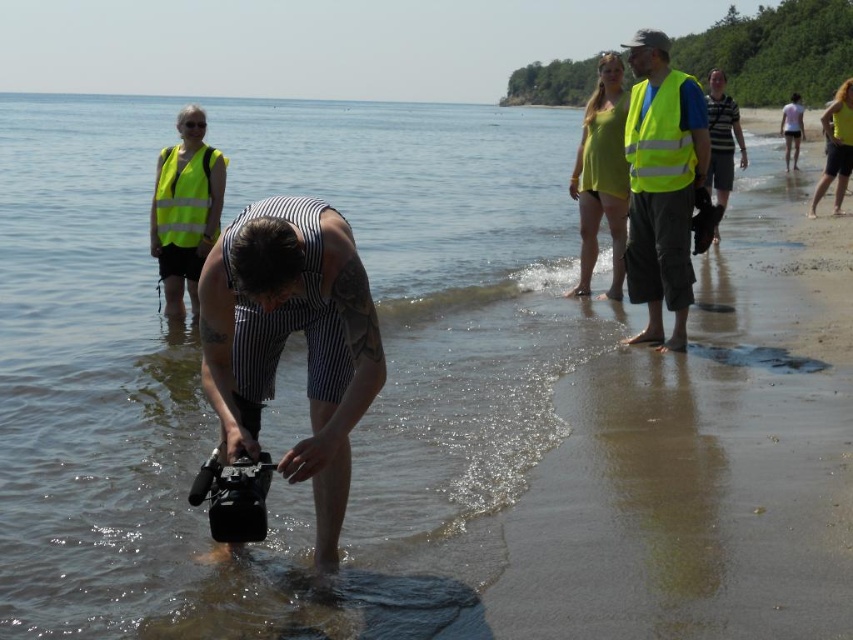
You are a photographer standing at the point marked as point (659, 138). You want to capture a photo of the man in the striped outfit holding the camera in the water. Is the yellow reflective vest at upper center blocking your view of the man?

The point (659, 138) corresponds to the yellow reflective vest at upper center, which is blocking the view of the man in the striped outfit holding the camera in the water.

You are a photographer at the beach scene. You need to capture a photo that includes both the high visibility vest at upper left and the striped fabric shirt at center. Which object should you adjust your camera angle to include first if they are not currently in the same frame?

The high visibility vest at upper left is positioned on the left side of the striped fabric shirt at center. To include both in the frame, adjust your camera angle to first include the high visibility vest at upper left since it is further to the left, then ensure the striped fabric shirt at center is also within the view.

You are standing at the shoreline in the beach scene. There is a point marked at coordinates (x=669, y=188). If you want to reach that point without getting your shoes wet, which direction should you move relative to your current position?

The point at (x=669, y=188) is 23.95 feet away from the viewer. Since it is located in the foreground near the shallow water where the man is standing, moving towards it would require walking into the water. To avoid getting your shoes wet, you should move away from the shoreline towards the dry sand area behind you.